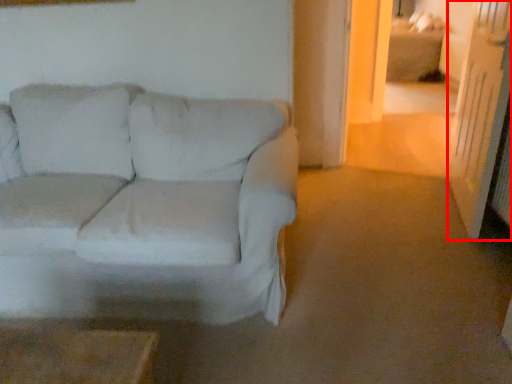
Question: Observing the image, what is the correct spatial positioning of glass door (annotated by the red box) in reference to studio couch?

Choices:
 (A) right
 (B) left

Answer: (A)